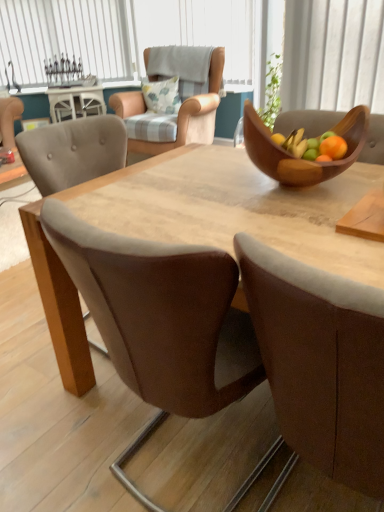
Locate an element on the screen. This screenshot has height=512, width=384. free space in front of wooden bowl at center is located at coordinates (298, 222).